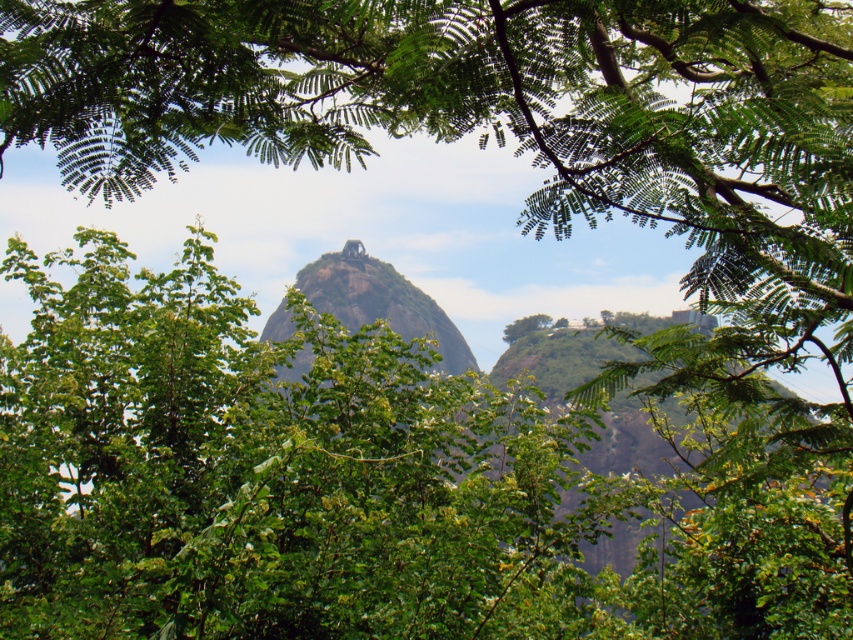
You are standing in a forest clearing and see the green rock formation at center and the green leafy tree at center. Which object is positioned to the left when facing the scene?

The green rock formation at center is positioned to the left of the green leafy tree at center.

You are planning to take a photo of the green leafy tree at center and the green rock formation at center. Which object should you focus on first if you want to capture both in a single frame without moving the camera?

The green rock formation at center is larger than the green leafy tree at center, so you should focus on the green rock formation at center first to ensure it fits within the frame.